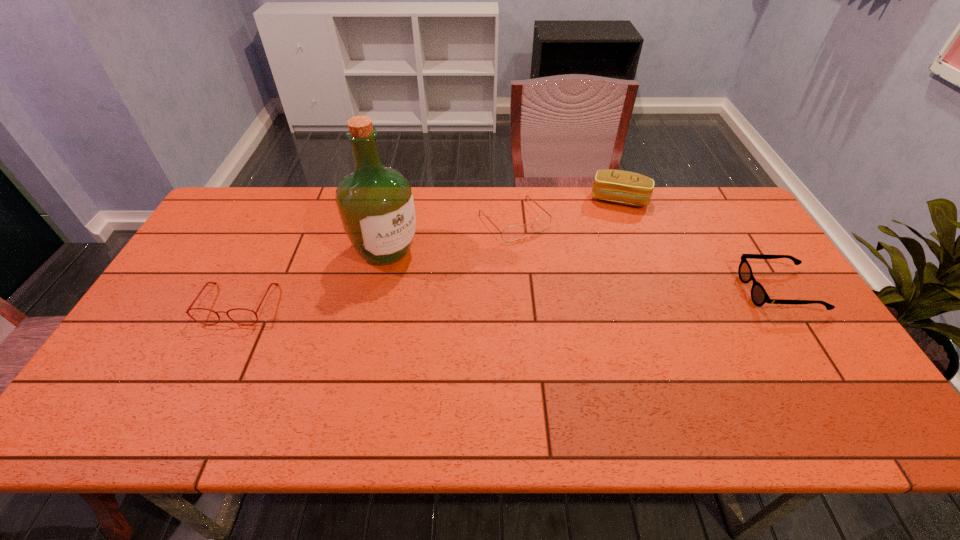
This screenshot has width=960, height=540. In order to click on vacant space at the near right corner of the desktop in this screenshot , I will do `click(822, 387)`.

Find the location of a particular element. free space between the fourth object from left to right and the rightmost spectacles is located at coordinates (699, 245).

Find the location of a particular element. Image resolution: width=960 pixels, height=540 pixels. free space between the tallest object and the rightmost object is located at coordinates (583, 271).

The image size is (960, 540). Identify the location of empty location between the rightmost object and the second object from left to right. (583, 271).

Image resolution: width=960 pixels, height=540 pixels. What are the coordinates of `free space between the tallest object and the fourth object from left to right` in the screenshot? It's located at (502, 225).

The image size is (960, 540). I want to click on vacant area that lies between the second spectacles from left to right and the tallest object, so click(x=450, y=235).

Find the location of a particular element. The height and width of the screenshot is (540, 960). vacant area that lies between the third object from right to left and the clutch bag is located at coordinates (x=566, y=210).

In order to click on free spot between the rightmost object and the liquor in this screenshot , I will do `click(583, 271)`.

Identify the location of vacant space that's between the fourth object from left to right and the tallest object. (502, 225).

Locate which object ranks second in proximity to the second spectacles from left to right. Please provide its 2D coordinates. Your answer should be formatted as a tuple, i.e. [(x, y)], where the tuple contains the x and y coordinates of a point satisfying the conditions above.

[(375, 203)]